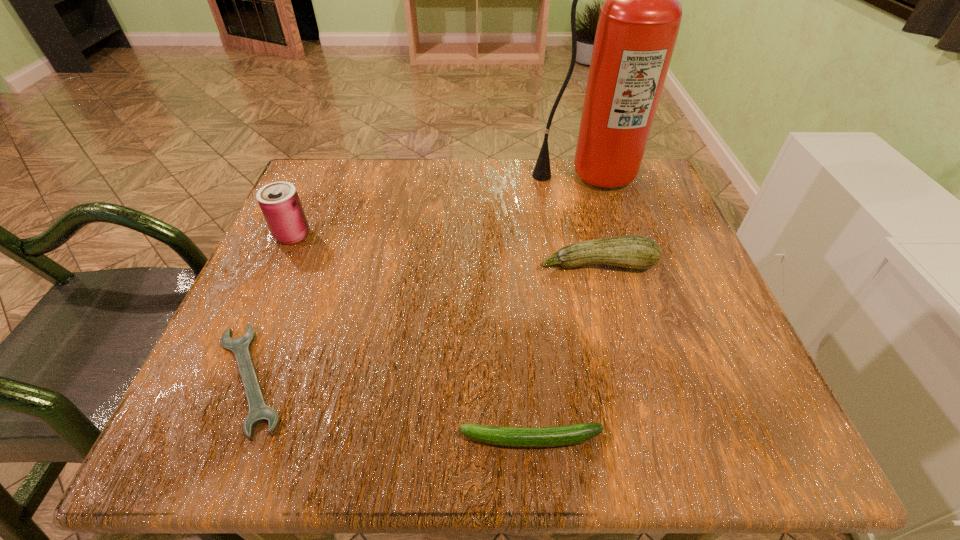
Locate an element on the screen. vacant space in between the fourth tallest object and the third shortest object is located at coordinates (564, 352).

I want to click on the closest object to the taller zucchini, so click(x=639, y=21).

Locate an element on the screen. Image resolution: width=960 pixels, height=540 pixels. object that stands as the closest to the fourth tallest object is located at coordinates (259, 412).

Where is `vacant space that satisfies the following two spatial constraints: 1. at the stem end of the third farthest object; 2. on the front-facing side of the nearer zucchini`? This screenshot has width=960, height=540. vacant space that satisfies the following two spatial constraints: 1. at the stem end of the third farthest object; 2. on the front-facing side of the nearer zucchini is located at coordinates (643, 439).

Find the location of a particular element. This screenshot has height=540, width=960. blank area in the image that satisfies the following two spatial constraints: 1. at the stem end of the farther zucchini; 2. on the front-facing side of the second shortest object is located at coordinates (643, 439).

You are a GUI agent. You are given a task and a screenshot of the screen. Output one action in this format:
    pyautogui.click(x=<x>, y=<y>)
    Task: Click on the vacant region that satisfies the following two spatial constraints: 1. at the stem end of the third farthest object; 2. on the front-facing side of the shorter zucchini
    This screenshot has width=960, height=540.
    Given the screenshot: What is the action you would take?
    pyautogui.click(x=643, y=439)

The height and width of the screenshot is (540, 960). I want to click on vacant space that satisfies the following two spatial constraints: 1. on the instruction side of the farthest object; 2. on the front-facing side of the shorter zucchini, so click(668, 439).

At what (x,y) coordinates should I click in order to perform the action: click on vacant region that satisfies the following two spatial constraints: 1. at the stem end of the farther zucchini; 2. on the front-facing side of the shorter zucchini. Please return your answer as a coordinate pair (x, y). This screenshot has width=960, height=540. Looking at the image, I should click on (643, 439).